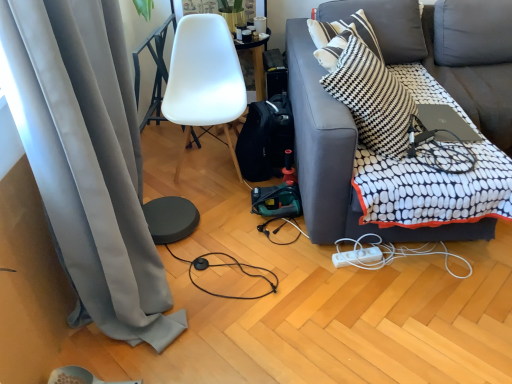
This screenshot has width=512, height=384. I want to click on vacant space in between white plastic power outlet at lower center and black cable at lower center, so click(302, 275).